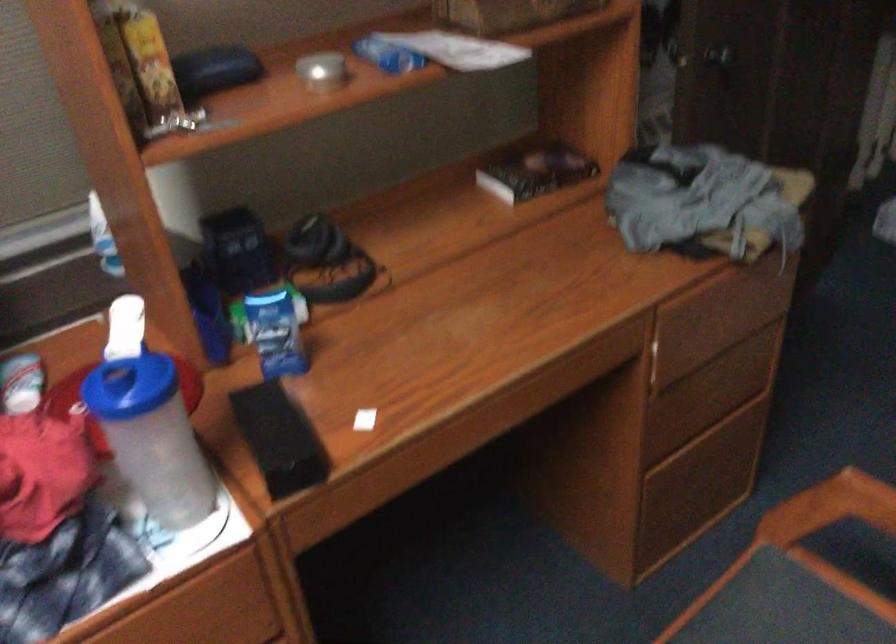
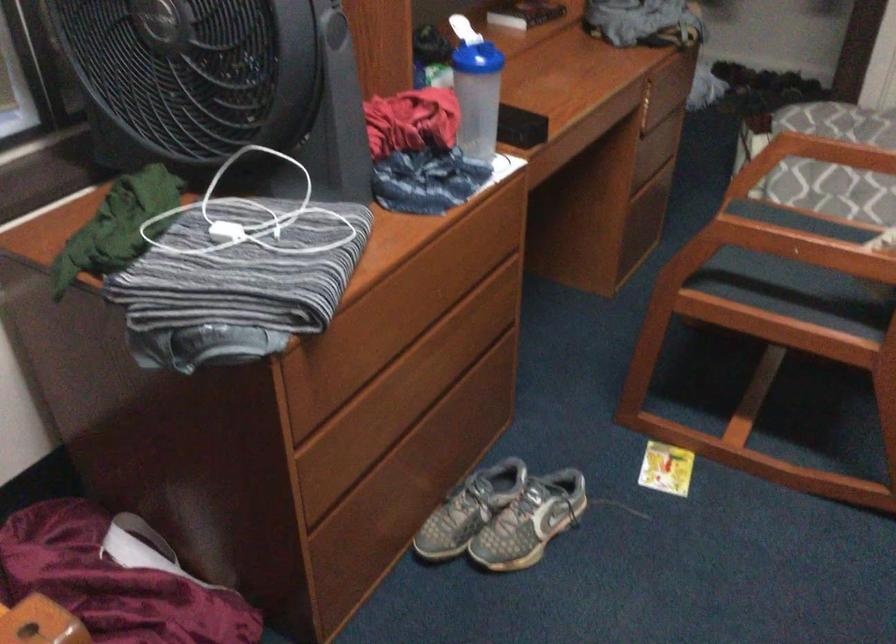
Find the pixel in the second image that matches (131,439) in the first image.

(478, 97)